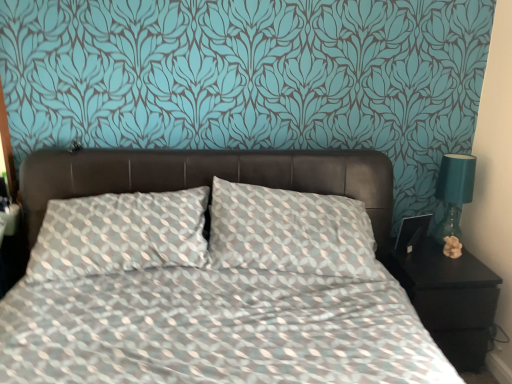
Find the location of a particular element. The height and width of the screenshot is (384, 512). empty space that is ontop of teal glass lamp at right (from a real-world perspective) is located at coordinates (457, 159).